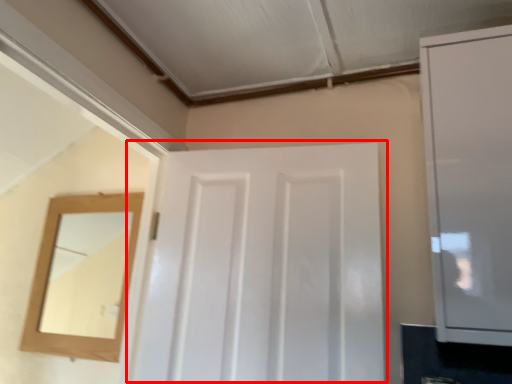
Question: From the image, what is the correct spatial relationship of door (annotated by the red box) in relation to cabinetry?

Choices:
 (A) right
 (B) left

Answer: (B)